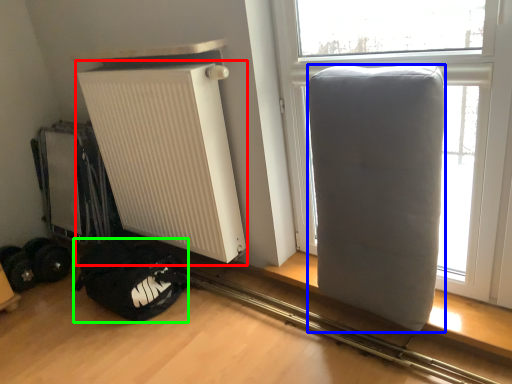
Question: Estimate the real-world distances between objects in this image. Which object is closer to radiator (highlighted by a red box), furniture (highlighted by a blue box) or sleeping bag (highlighted by a green box)?

Choices:
 (A) furniture
 (B) sleeping bag

Answer: (B)